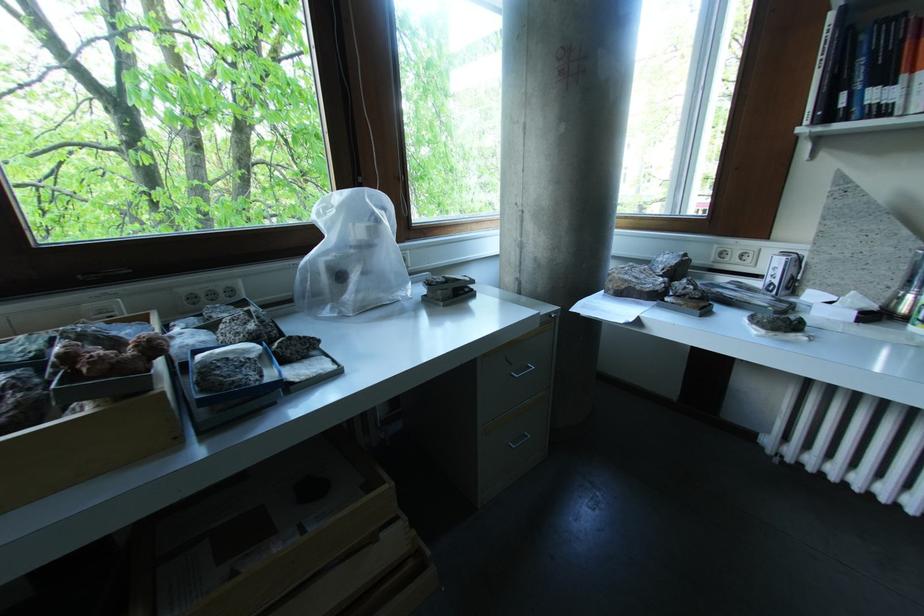
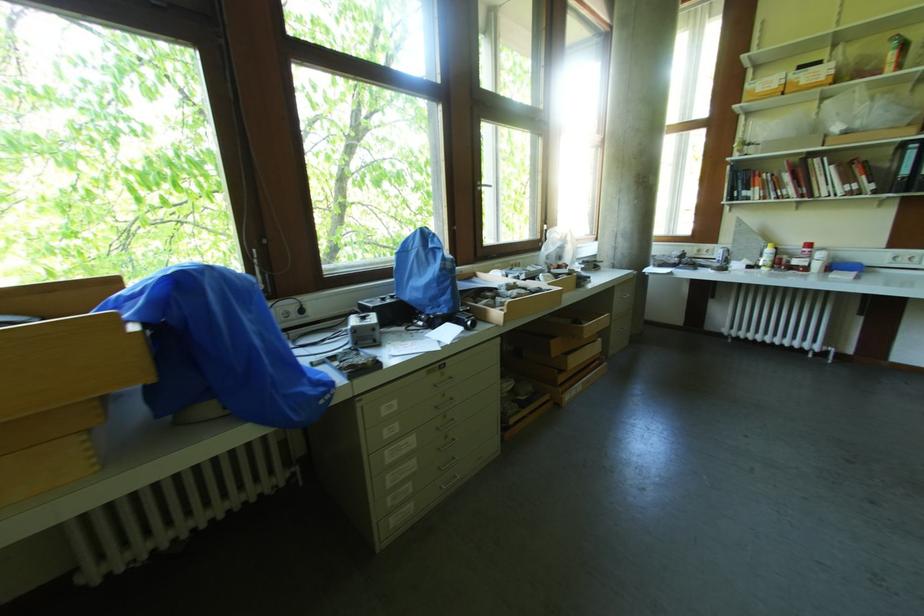
In a continuous first-person perspective shot, in which direction is the camera moving?

The cameraman walked toward left, backward.